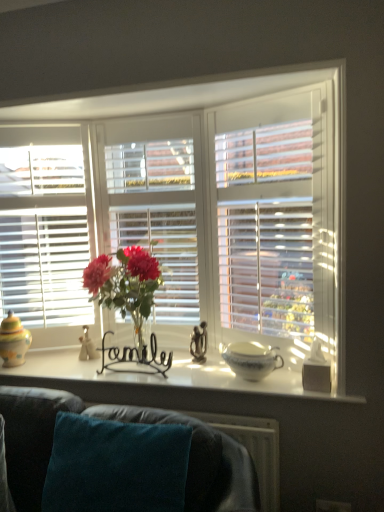
The width and height of the screenshot is (384, 512). I want to click on vacant space in between multicolored ceramic jar at left, arranged as the first candle holder when viewed from the back, and black wire at center, the 2th candle holder when ordered from left to right, so click(87, 368).